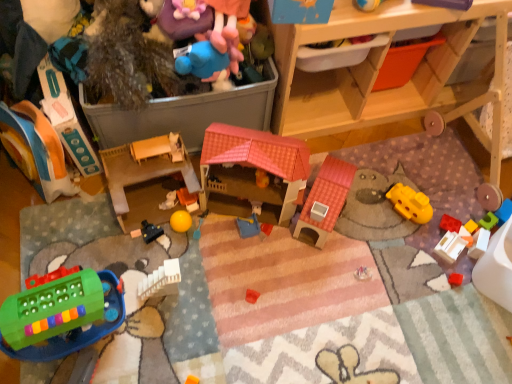
Find the location of a particular element. vacant space behind translucent plastic cube at center, the first toy when ordered from right to left is located at coordinates (453, 190).